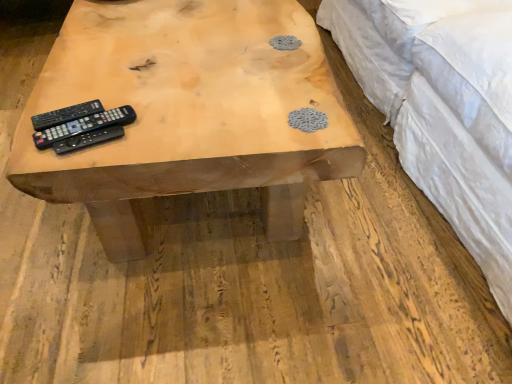
I want to click on vacant area situated to the left side of black matte remote control at center, which appears as the first remote control when viewed from the front, so click(32, 135).